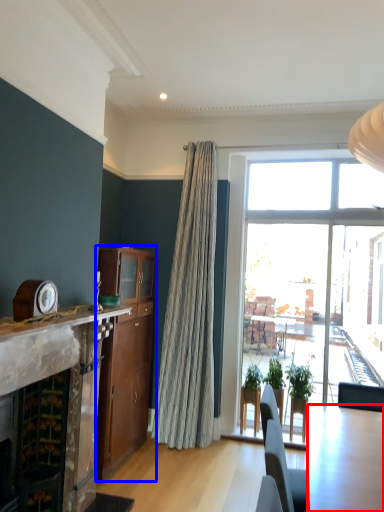
Question: Which object is further to the camera taking this photo, kitchen & dining room table (highlighted by a red box) or cabinetry (highlighted by a blue box)?

Choices:
 (A) kitchen & dining room table
 (B) cabinetry

Answer: (B)